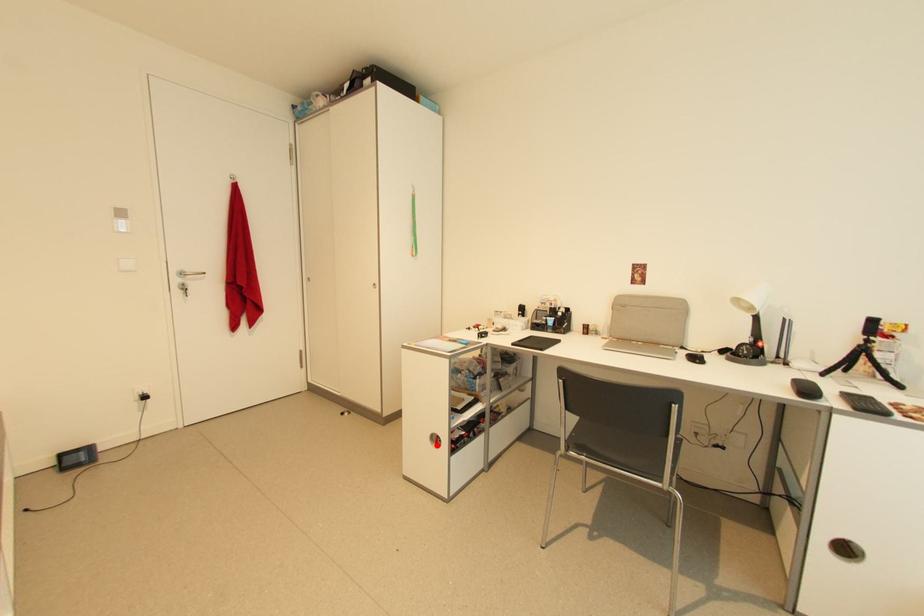
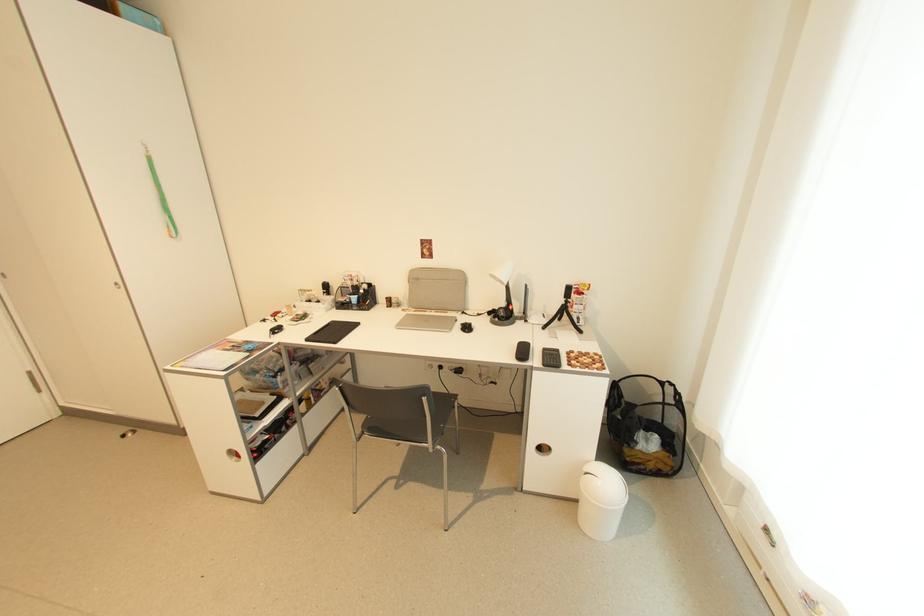
Question: I am providing you with two images of the same scene from different viewpoints. A red point is shown in image1. For the corresponding object point in image2, is it positioned nearer or farther from the camera?

Choices:
 (A) Nearer
 (B) Farther

Answer: (A)